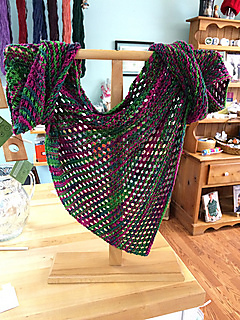
Image resolution: width=240 pixels, height=320 pixels. I want to click on drawer, so click(x=220, y=175).